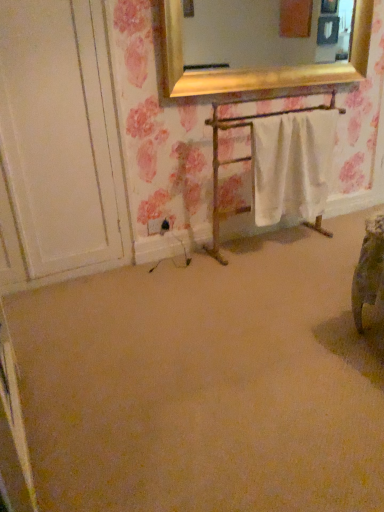
Identify the location of free space in front of white fabric towel rack at center. This screenshot has width=384, height=512. (271, 285).